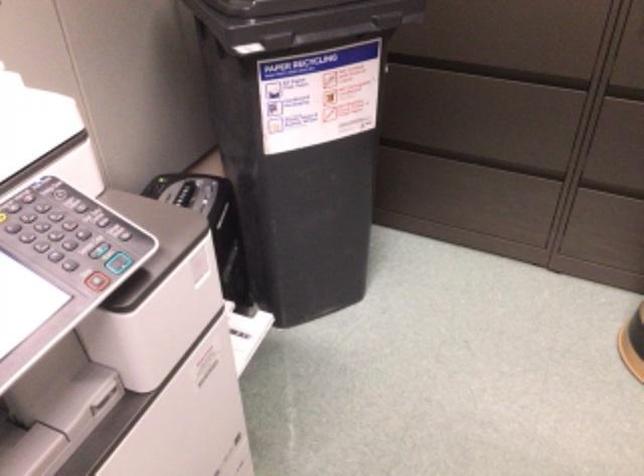
Where is `blue start button`? blue start button is located at coordinates (118, 262).